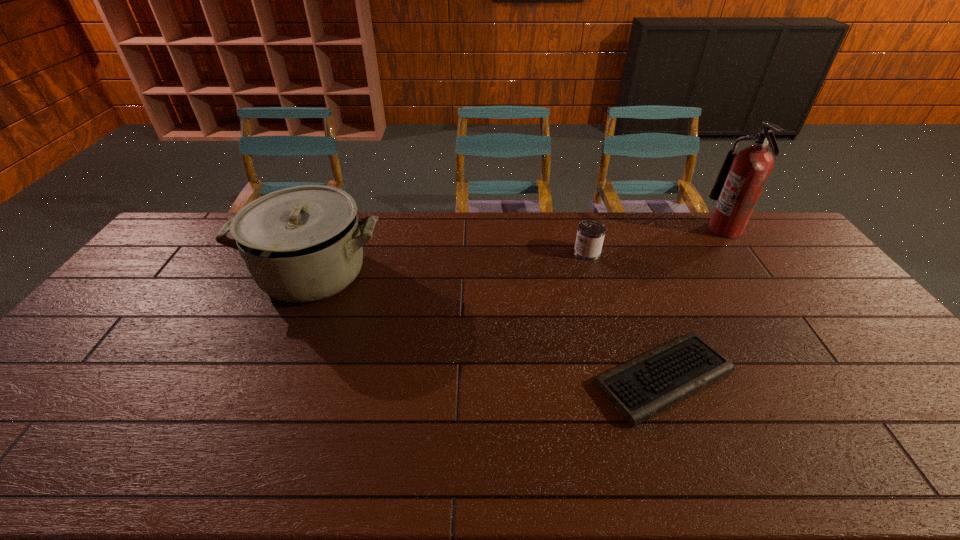
The image size is (960, 540). Find the location of `blank region between the can and the leftmost object`. blank region between the can and the leftmost object is located at coordinates (450, 264).

You are a GUI agent. You are given a task and a screenshot of the screen. Output one action in this format:
    pyautogui.click(x=<x>, y=<y>)
    Task: Click on the free space that is in between the computer keyboard and the can
    This screenshot has width=960, height=540.
    Given the screenshot: What is the action you would take?
    pyautogui.click(x=625, y=315)

You are a GUI agent. You are given a task and a screenshot of the screen. Output one action in this format:
    pyautogui.click(x=<x>, y=<y>)
    Task: Click on the free point between the rightmost object and the can
    
    Given the screenshot: What is the action you would take?
    pyautogui.click(x=656, y=241)

Locate which object is the third closest to the saucepan. Please provide its 2D coordinates. Your answer should be formatted as a tuple, i.e. [(x, y)], where the tuple contains the x and y coordinates of a point satisfying the conditions above.

[(741, 180)]

Where is `object that ranks as the third closest to the saucepan`? Image resolution: width=960 pixels, height=540 pixels. object that ranks as the third closest to the saucepan is located at coordinates (741, 180).

At what (x,y) coordinates should I click in order to perform the action: click on free space that satisfies the following two spatial constraints: 1. on the front side of the second shortest object; 2. on the left side of the nearest object. Please return your answer as a coordinate pair (x, y). This screenshot has height=540, width=960. Looking at the image, I should click on (624, 377).

At what (x,y) coordinates should I click in order to perform the action: click on free location that satisfies the following two spatial constraints: 1. on the front of the rightmost object near the operation label; 2. on the front side of the shortest object. Please return your answer as a coordinate pair (x, y). Looking at the image, I should click on (832, 377).

Identify the location of vacant area in the image that satisfies the following two spatial constraints: 1. on the front of the tallest object near the operation label; 2. on the front side of the computer keyboard. (832, 377).